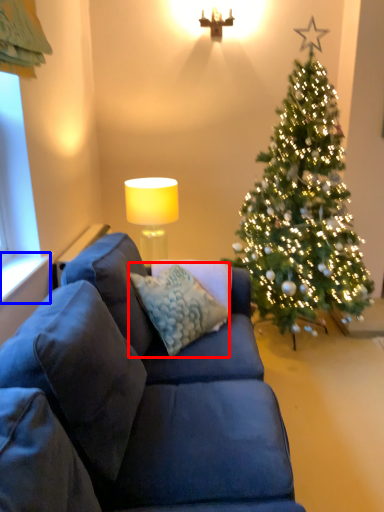
Question: Among these objects, which one is farthest to the camera, pillow (highlighted by a red box) or window sill (highlighted by a blue box)?

Choices:
 (A) pillow
 (B) window sill

Answer: (A)